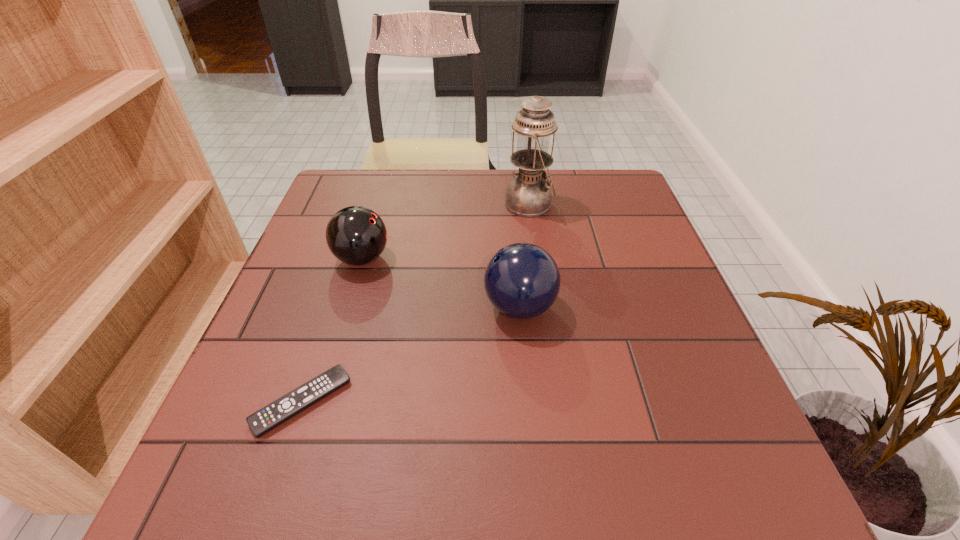
You are a GUI agent. You are given a task and a screenshot of the screen. Output one action in this format:
    pyautogui.click(x=<x>, y=<y>)
    Task: Click on the vacant space at the right edge of the desktop
    This screenshot has height=540, width=960.
    Given the screenshot: What is the action you would take?
    pyautogui.click(x=601, y=218)

This screenshot has height=540, width=960. What are the coordinates of `vacant space at the far left corner of the desktop` in the screenshot? It's located at click(x=381, y=190).

Where is `free space at the far right corner of the desktop`? free space at the far right corner of the desktop is located at coordinates (579, 176).

This screenshot has width=960, height=540. In order to click on free space between the second nearest object and the farther bowling ball in this screenshot , I will do `click(441, 283)`.

Identify the location of free space between the farther bowling ball and the nearest object. (332, 330).

Locate an element on the screen. This screenshot has width=960, height=540. free spot between the tallest object and the shortest object is located at coordinates (416, 303).

Locate an element on the screen. free point between the nearest object and the third farthest object is located at coordinates (411, 355).

Image resolution: width=960 pixels, height=540 pixels. Identify the location of vacant point located between the nearest object and the third farthest object. (411, 355).

Image resolution: width=960 pixels, height=540 pixels. I want to click on free area in between the right bowling ball and the second farthest object, so click(441, 283).

Identify the location of vacant space in between the nearer bowling ball and the remote control. (411, 355).